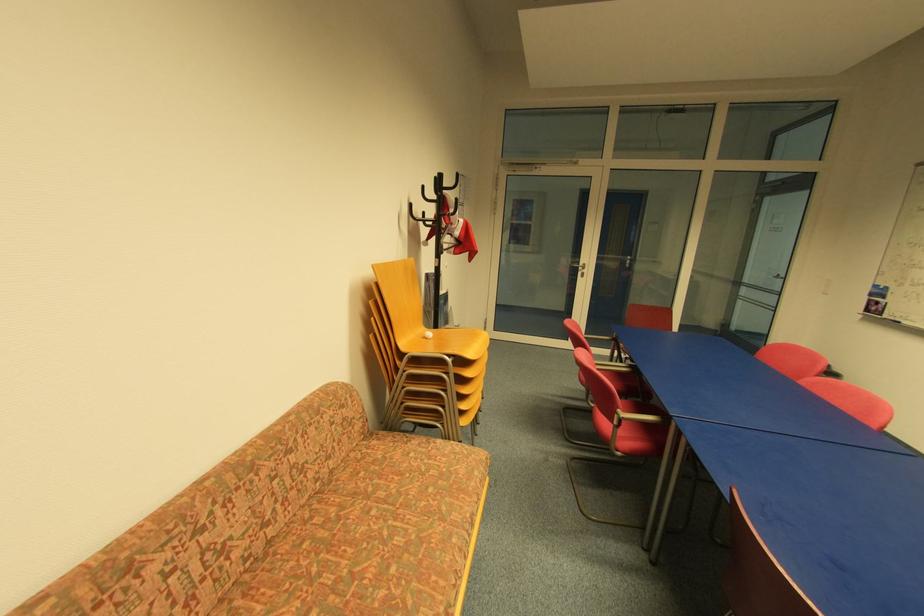
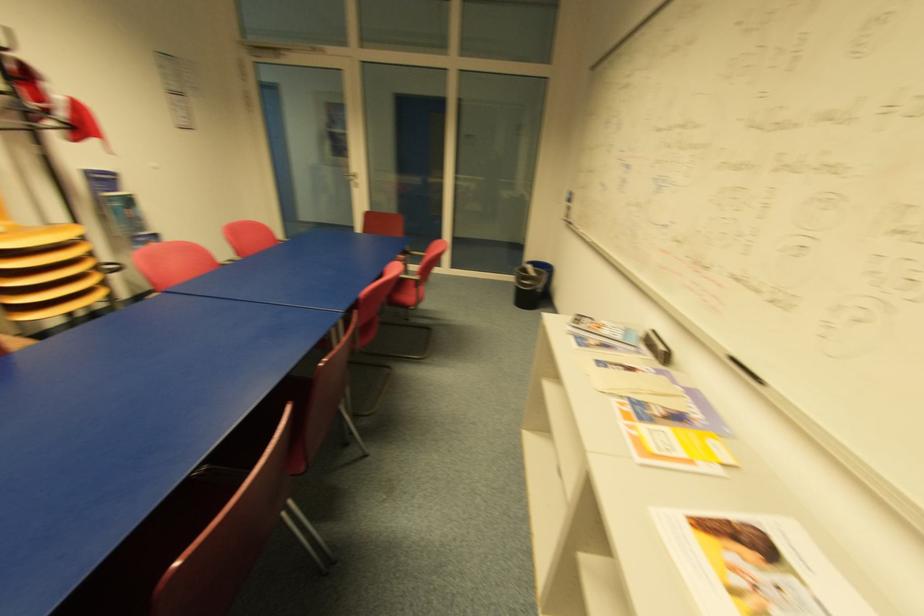
Question: In a continuous first-person perspective shot, in which direction is the camera moving?

Choices:
 (A) Left
 (B) Right
 (C) Forward
 (D) Backward

Answer: (B)